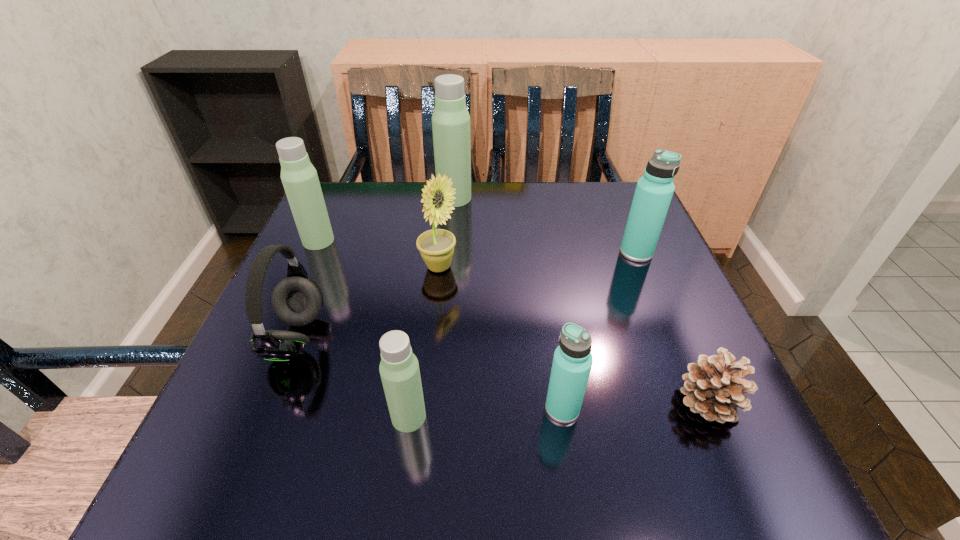
The height and width of the screenshot is (540, 960). In the image, there is a desktop. In order to click on vacant region at the near edge in this screenshot , I will do `click(405, 468)`.

I want to click on free location at the left edge, so click(x=300, y=327).

This screenshot has height=540, width=960. In order to click on free location at the right edge of the desktop in this screenshot , I will do `click(639, 335)`.

The height and width of the screenshot is (540, 960). In the image, there is a desktop. Find the location of `vacant space at the near left corner`. vacant space at the near left corner is located at coordinates (278, 485).

This screenshot has width=960, height=540. I want to click on vacant space at the far right corner of the desktop, so click(x=633, y=187).

Locate an element on the screen. The width and height of the screenshot is (960, 540). free space between the second biggest light thermos bottle and the farthest thermos bottle is located at coordinates (387, 219).

Where is `vacant region between the third object from right to left and the black headset`? vacant region between the third object from right to left and the black headset is located at coordinates (429, 373).

In order to click on empty location between the leftmost light thermos bottle and the farther aqua thermos bottle in this screenshot , I will do `click(477, 247)`.

Identify the location of vacant area between the fourth thermos bottle from left to right and the farther aqua thermos bottle. Image resolution: width=960 pixels, height=540 pixels. (599, 330).

This screenshot has height=540, width=960. Find the location of `vacant region between the leftmost light thermos bottle and the shortest object`. vacant region between the leftmost light thermos bottle and the shortest object is located at coordinates (514, 321).